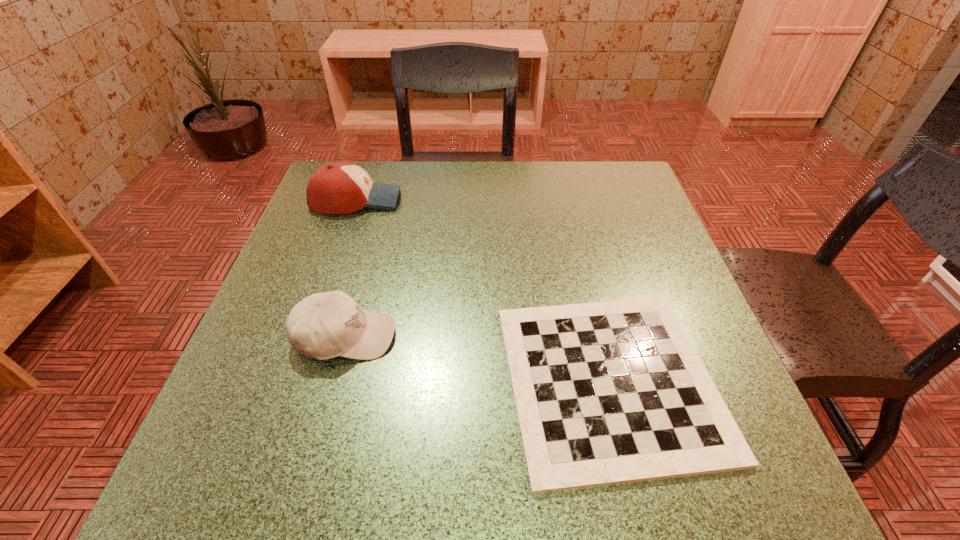
Image resolution: width=960 pixels, height=540 pixels. Identify the location of object located at the far left corner. (340, 187).

Locate an element on the screen. Image resolution: width=960 pixels, height=540 pixels. object that is at the near right corner is located at coordinates (613, 392).

The height and width of the screenshot is (540, 960). I want to click on free space at the far edge, so click(414, 184).

The height and width of the screenshot is (540, 960). In the image, there is a desktop. What are the coordinates of `vacant space at the near edge` in the screenshot? It's located at (462, 458).

Identify the location of vacant region at the left edge of the desktop. (328, 233).

Where is `vacant space at the right edge of the desktop`? This screenshot has height=540, width=960. vacant space at the right edge of the desktop is located at coordinates (684, 292).

Locate an element on the screen. This screenshot has width=960, height=540. vacant space at the near left corner of the desktop is located at coordinates (257, 441).

At what (x,y) coordinates should I click in order to perform the action: click on free spot at the near right corner of the desktop. Please return your answer as a coordinate pair (x, y). The image size is (960, 540). Looking at the image, I should click on (767, 462).

Where is `vacant area that lies between the checkerboard and the nearer baseball cap`? vacant area that lies between the checkerboard and the nearer baseball cap is located at coordinates (477, 359).

This screenshot has height=540, width=960. In order to click on vacant point located between the rightmost object and the farther baseball cap in this screenshot , I will do [483, 290].